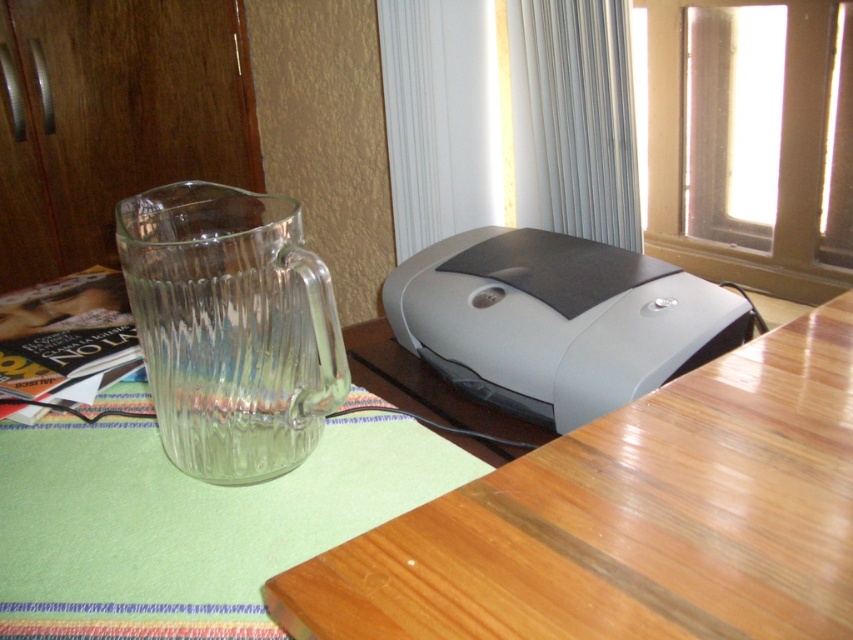
Question: Which point is closer to the camera?

Choices:
 (A) wooden table at upper right
 (B) clear glass pitcher at lower left
 (C) gray matte printer at center

Answer: (A)

Question: Does wooden table at upper right appear under clear glass pitcher at lower left?

Choices:
 (A) yes
 (B) no

Answer: (A)

Question: Does wooden table at upper right have a greater width compared to gray matte printer at center?

Choices:
 (A) no
 (B) yes

Answer: (A)

Question: Which of these objects is positioned farthest from the wooden table at upper right?

Choices:
 (A) gray matte printer at center
 (B) clear glass pitcher at lower left

Answer: (A)

Question: Is wooden table at upper right thinner than clear glass pitcher at lower left?

Choices:
 (A) yes
 (B) no

Answer: (B)

Question: Among these objects, which one is nearest to the camera?

Choices:
 (A) wooden table at upper right
 (B) gray matte printer at center
 (C) clear glass pitcher at lower left

Answer: (A)